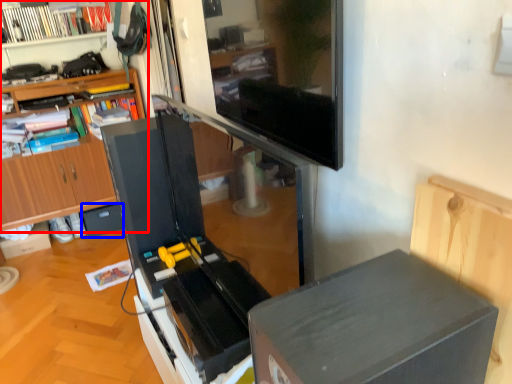
Question: Which object is further to the camera taking this photo, bookcase (highlighted by a red box) or drawer (highlighted by a blue box)?

Choices:
 (A) bookcase
 (B) drawer

Answer: (B)